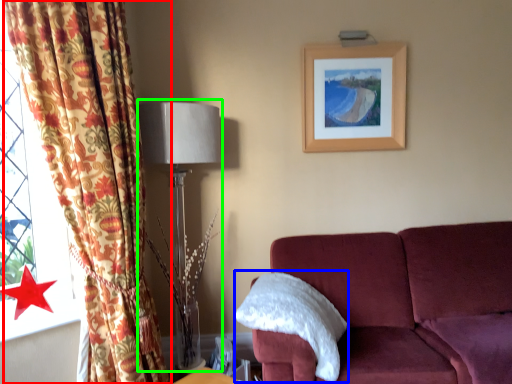
Question: Which object is positioned farthest from curtain (highlighted by a red box)? Select from pillow (highlighted by a blue box) and table lamp (highlighted by a green box).

Choices:
 (A) pillow
 (B) table lamp

Answer: (A)